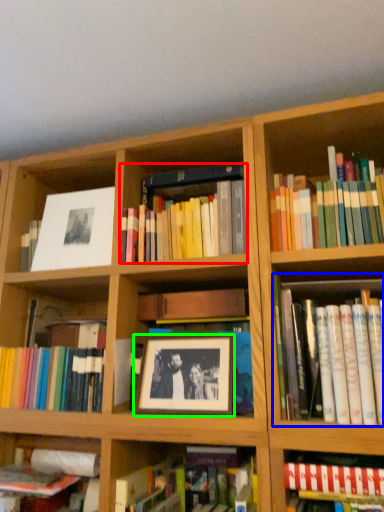
Question: Considering the real-world distances, which object is farthest from book (highlighted by a red box)? book (highlighted by a blue box) or picture frame (highlighted by a green box)?

Choices:
 (A) book
 (B) picture frame

Answer: (A)